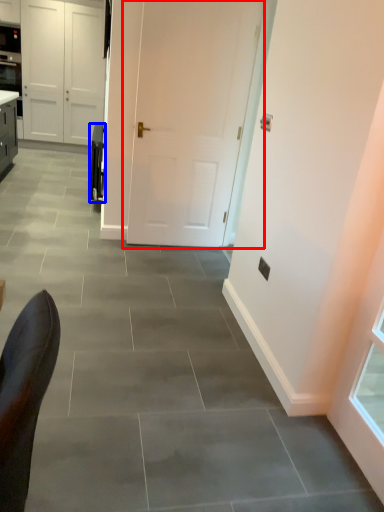
Question: Which object is closer to the camera taking this photo, door (highlighted by a red box) or appliance (highlighted by a blue box)?

Choices:
 (A) door
 (B) appliance

Answer: (A)